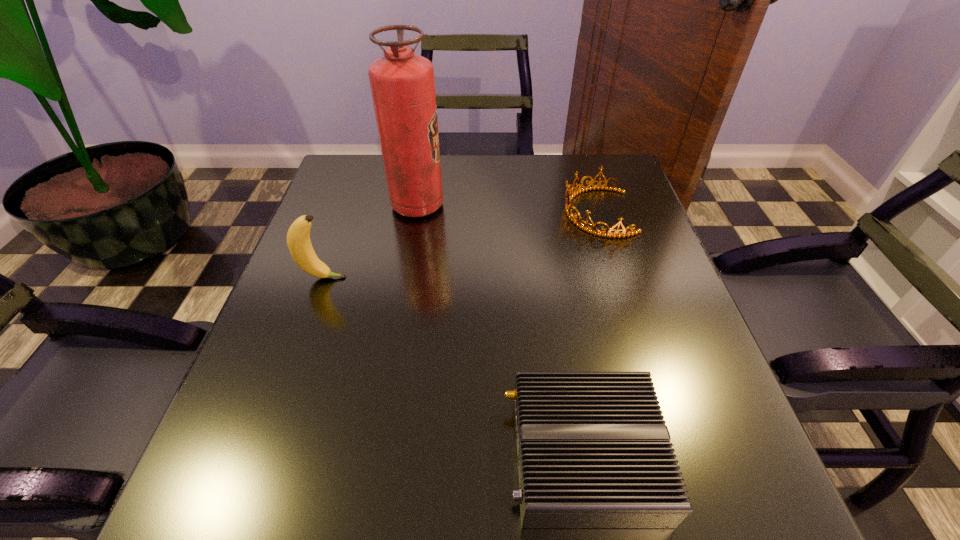
I want to click on router that is at the right edge, so click(593, 449).

The image size is (960, 540). What are the coordinates of `object that is at the far right corner` in the screenshot? It's located at (593, 230).

The height and width of the screenshot is (540, 960). Find the location of `object located in the near right corner section of the desktop`. object located in the near right corner section of the desktop is located at coordinates (593, 449).

In the image, there is a desktop. Where is `free region at the far edge`? The width and height of the screenshot is (960, 540). free region at the far edge is located at coordinates (543, 158).

Locate an element on the screen. vacant space at the near edge of the desktop is located at coordinates tap(450, 508).

Locate an element on the screen. The height and width of the screenshot is (540, 960). free space at the left edge of the desktop is located at coordinates (365, 266).

Locate an element on the screen. This screenshot has width=960, height=540. blank area at the right edge is located at coordinates (638, 228).

Where is `vacant position at the far left corner of the desktop`? vacant position at the far left corner of the desktop is located at coordinates (357, 165).

Image resolution: width=960 pixels, height=540 pixels. Identify the location of free spot at the near left corner of the desktop. pyautogui.click(x=199, y=488).

Where is `free region at the near right corner`? free region at the near right corner is located at coordinates (708, 487).